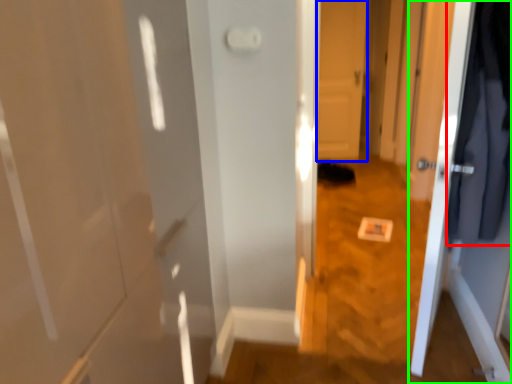
Question: Which object is positioned farthest from clothing (highlighted by a red box)? Select from door (highlighted by a blue box) and door (highlighted by a green box).

Choices:
 (A) door
 (B) door

Answer: (A)